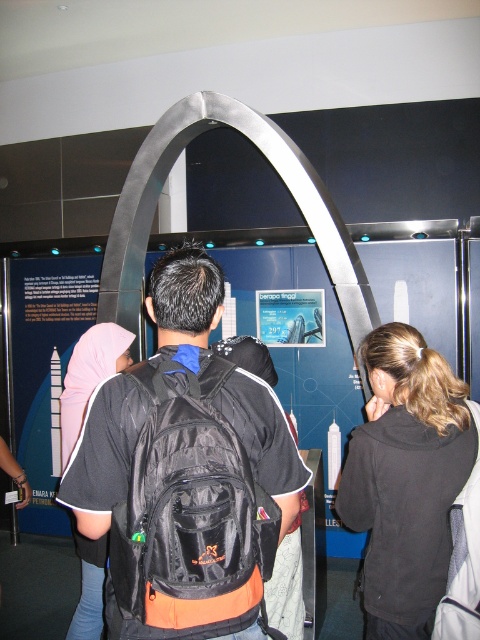
Does black fabric jacket at center appear on the left side of matte pink hijab at upper left?

Incorrect, black fabric jacket at center is not on the left side of matte pink hijab at upper left.

Can you confirm if black fabric jacket at center is taller than matte pink hijab at upper left?

Yes.

Is point (444, 541) positioned behind point (98, 557)?

No, it is in front of (98, 557).

Locate an element on the screen. black fabric jacket at center is located at coordinates (406, 480).

What do you see at coordinates (184, 472) in the screenshot?
I see `black fabric backpack at center` at bounding box center [184, 472].

Does point (192, 634) lie behind point (399, 541)?

No.

Measure the distance between black fabric backpack at center and camera.

black fabric backpack at center and camera are 1.18 meters apart from each other.

Identify the location of black fabric backpack at center. The width and height of the screenshot is (480, 640). (184, 472).

Does black fabric backpack at center appear under matte pink hijab at upper left?

Indeed, black fabric backpack at center is positioned under matte pink hijab at upper left.

Can you confirm if black fabric backpack at center is bigger than matte pink hijab at upper left?

Indeed, black fabric backpack at center has a larger size compared to matte pink hijab at upper left.

The height and width of the screenshot is (640, 480). I want to click on black fabric backpack at center, so click(184, 472).